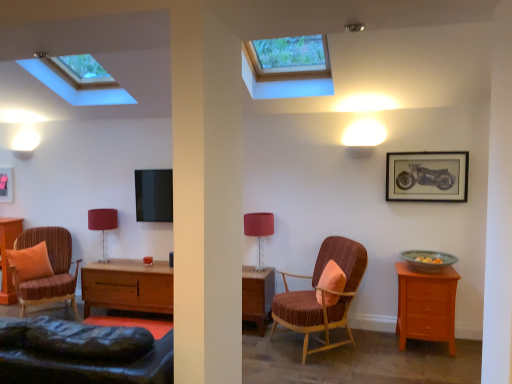
What is the approximate width of matte brown armchair at left, the 1th chair in the left-to-right sequence?

The width of matte brown armchair at left, the 1th chair in the left-to-right sequence, is 32.75 inches.

Describe the element at coordinates (315, 295) in the screenshot. This screenshot has width=512, height=384. I see `velvet-like brown armchair at center, which appears as the first chair when viewed from the right` at that location.

Measure the distance between velvet-like brown armchair at center, the second chair in the left-to-right sequence, and camera.

The depth of velvet-like brown armchair at center, the second chair in the left-to-right sequence, is 3.56 meters.

What do you see at coordinates (259, 230) in the screenshot?
I see `matte pink fabric at center, positioned as the first table lamp in front-to-back order` at bounding box center [259, 230].

The height and width of the screenshot is (384, 512). In order to click on matte black picture frame at upper left, acting as the second picture frame starting from the front in this screenshot , I will do `click(6, 185)`.

From a real-world perspective, is velvet-like brown armchair at center, which appears as the first chair when viewed from the right, below matte black picture frame at upper left, acting as the second picture frame starting from the front?

Yes.

Considering the sizes of objects velvet-like brown armchair at center, the second chair in the left-to-right sequence, and matte black picture frame at upper left, acting as the second picture frame starting from the front, in the image provided, who is bigger, velvet-like brown armchair at center, the second chair in the left-to-right sequence, or matte black picture frame at upper left, acting as the second picture frame starting from the front,?

With larger size is velvet-like brown armchair at center, the second chair in the left-to-right sequence.

Is velvet-like brown armchair at center, the second chair in the left-to-right sequence, to the left or to the right of matte black picture frame at upper left, which is counted as the second picture frame, starting from the right, in the image?

Clearly, velvet-like brown armchair at center, the second chair in the left-to-right sequence, is on the right of matte black picture frame at upper left, which is counted as the second picture frame, starting from the right, in the image.

Is velvet-like brown armchair at center, the second chair in the left-to-right sequence, in front of matte black picture frame at upper left, which appears as the first picture frame when viewed from the back?

Yes, velvet-like brown armchair at center, the second chair in the left-to-right sequence, is in front of matte black picture frame at upper left, which appears as the first picture frame when viewed from the back.

Could you measure the distance between matte black picture frame at upper right, positioned as the first picture frame in front-to-back order, and wooden nightstand at left?

matte black picture frame at upper right, positioned as the first picture frame in front-to-back order, and wooden nightstand at left are 4.25 meters apart from each other.

Who is shorter, matte black picture frame at upper right, which is the 1th picture frame from right to left, or wooden nightstand at left?

With less height is matte black picture frame at upper right, which is the 1th picture frame from right to left.

In terms of size, does matte black picture frame at upper right, positioned as the first picture frame in front-to-back order, appear bigger or smaller than wooden nightstand at left?

matte black picture frame at upper right, positioned as the first picture frame in front-to-back order, is smaller than wooden nightstand at left.

Is matte black picture frame at upper right, positioned as the first picture frame in front-to-back order, positioned beyond the bounds of wooden nightstand at left?

Yes, matte black picture frame at upper right, positioned as the first picture frame in front-to-back order, is located beyond the bounds of wooden nightstand at left.

In the image, is matte orange cushion at left, positioned as the 1th pillow in left-to-right order, positioned in front of or behind velvet-like brown armchair at center, the second chair in the left-to-right sequence?

Clearly, matte orange cushion at left, positioned as the 1th pillow in left-to-right order, is behind velvet-like brown armchair at center, the second chair in the left-to-right sequence.

Does matte orange cushion at left, which is counted as the 2th pillow, starting from the right, have a greater width compared to velvet-like brown armchair at center, which appears as the first chair when viewed from the right?

Incorrect, the width of matte orange cushion at left, which is counted as the 2th pillow, starting from the right, does not surpass that of velvet-like brown armchair at center, which appears as the first chair when viewed from the right.

Which object is wider, matte orange cushion at left, which is counted as the 2th pillow, starting from the right, or matte black picture frame at upper left, acting as the second picture frame starting from the front?

matte orange cushion at left, which is counted as the 2th pillow, starting from the right.

Can you confirm if matte orange cushion at left, which is counted as the 2th pillow, starting from the right, is bigger than matte black picture frame at upper left, the first picture frame from the left?

Yes, matte orange cushion at left, which is counted as the 2th pillow, starting from the right, is bigger than matte black picture frame at upper left, the first picture frame from the left.

Looking at this image, do you think matte orange cushion at left, which is counted as the 2th pillow, starting from the front, is within matte black picture frame at upper left, the first picture frame from the left, or outside of it?

matte orange cushion at left, which is counted as the 2th pillow, starting from the front, is not enclosed by matte black picture frame at upper left, the first picture frame from the left.

From the image's perspective, is matte orange cushion at left, which is counted as the 2th pillow, starting from the front, positioned above or below matte black picture frame at upper left, which is counted as the second picture frame, starting from the right?

From the image's perspective, matte orange cushion at left, which is counted as the 2th pillow, starting from the front, appears below matte black picture frame at upper left, which is counted as the second picture frame, starting from the right.

Is matte brown armchair at left, the 1th chair in the left-to-right sequence, not inside orange fabric pillow at center, marked as the 2th pillow in a back-to-front arrangement?

Yes, matte brown armchair at left, the 1th chair in the left-to-right sequence, is outside of orange fabric pillow at center, marked as the 2th pillow in a back-to-front arrangement.

Which of these two, matte brown armchair at left, which is counted as the second chair, starting from the right, or orange fabric pillow at center, which is the first pillow in front-to-back order, stands taller?

matte brown armchair at left, which is counted as the second chair, starting from the right.

Based on their positions, is matte brown armchair at left, which is counted as the second chair, starting from the right, located to the left or right of orange fabric pillow at center, marked as the 2th pillow in a back-to-front arrangement?

Clearly, matte brown armchair at left, which is counted as the second chair, starting from the right, is on the left of orange fabric pillow at center, marked as the 2th pillow in a back-to-front arrangement, in the image.

Is point (22, 292) less distant than point (338, 288)?

No, (22, 292) is behind (338, 288).

Is matte pink fabric at center, positioned as the first table lamp in front-to-back order, far away from matte black picture frame at upper right, which is the 1th picture frame from right to left?

matte pink fabric at center, positioned as the first table lamp in front-to-back order, is positioned a significant distance from matte black picture frame at upper right, which is the 1th picture frame from right to left.

From their relative heights in the image, would you say matte pink fabric at center, which appears as the 2th table lamp when viewed from the back, is taller or shorter than matte black picture frame at upper right, marked as the second picture frame in a left-to-right arrangement?

Considering their sizes, matte pink fabric at center, which appears as the 2th table lamp when viewed from the back, has more height than matte black picture frame at upper right, marked as the second picture frame in a left-to-right arrangement.

From the picture: How many degrees apart are the facing directions of matte pink fabric at center, which ranks as the first table lamp in right-to-left order, and matte black picture frame at upper right, marked as the second picture frame in a left-to-right arrangement?

There is a 2.56e-05-degree angle between the facing directions of matte pink fabric at center, which ranks as the first table lamp in right-to-left order, and matte black picture frame at upper right, marked as the second picture frame in a left-to-right arrangement.

Between matte pink fabric at center, which appears as the 2th table lamp when viewed from the back, and matte black picture frame at upper right, the second picture frame positioned from the back, which one has larger width?

matte pink fabric at center, which appears as the 2th table lamp when viewed from the back.

Considering the positions of objects light brown wooden chest of drawers at right and orange fabric pillow at center, which is the first pillow in front-to-back order, in the image provided, who is more to the right, light brown wooden chest of drawers at right or orange fabric pillow at center, which is the first pillow in front-to-back order,?

Positioned to the right is light brown wooden chest of drawers at right.

Which is in front, light brown wooden chest of drawers at right or orange fabric pillow at center, which ranks as the second pillow in left-to-right order?

light brown wooden chest of drawers at right is closer to the camera.

From the image's perspective, would you say light brown wooden chest of drawers at right is shown under orange fabric pillow at center, which is the first pillow in front-to-back order?

Yes.

Can you see light brown wooden chest of drawers at right touching orange fabric pillow at center, marked as the 1th pillow in a right-to-left arrangement?

light brown wooden chest of drawers at right is not next to orange fabric pillow at center, marked as the 1th pillow in a right-to-left arrangement, and they're not touching.

From the image's perspective, starting from the matte black picture frame at upper left, acting as the second picture frame starting from the front, which chair is the 2nd one below? Please provide its 2D coordinates.

[(315, 295)]

Find the location of a particular element. nightstand below the matte black picture frame at upper right, the second picture frame positioned from the back (from a real-world perspective) is located at coordinates (6, 257).

When comparing their distances from matte pink fabric at center, which ranks as the first table lamp in right-to-left order, does orange fabric pillow at center, marked as the 2th pillow in a back-to-front arrangement, or matte red lampshade at center, positioned as the 1th table lamp in left-to-right order, seem further?

matte red lampshade at center, positioned as the 1th table lamp in left-to-right order, is positioned further to the anchor matte pink fabric at center, which ranks as the first table lamp in right-to-left order.

From the image, which object appears to be farther from matte red lampshade at center, which is the second table lamp from right to left, wooden nightstand at left or matte pink fabric at center, positioned as the first table lamp in front-to-back order?

matte pink fabric at center, positioned as the first table lamp in front-to-back order, is positioned further to the anchor matte red lampshade at center, which is the second table lamp from right to left.

Estimate the real-world distances between objects in this image. Which object is closer to matte black picture frame at upper left, which appears as the first picture frame when viewed from the back, matte pink fabric at center, the second table lamp positioned from the left, or matte red lampshade at center, positioned as the 1th table lamp in left-to-right order?

matte red lampshade at center, positioned as the 1th table lamp in left-to-right order, lies closer to matte black picture frame at upper left, which appears as the first picture frame when viewed from the back, than the other object.

Looking at the image, which one is located further to wooden nightstand at left, matte pink fabric at center, which ranks as the first table lamp in right-to-left order, or matte red lampshade at center, positioned as the 1th table lamp in left-to-right order?

Based on the image, matte pink fabric at center, which ranks as the first table lamp in right-to-left order, appears to be further to wooden nightstand at left.

Which object lies nearer to the anchor point matte black picture frame at upper left, which is counted as the second picture frame, starting from the right, light brown wooden chest of drawers at right or matte pink fabric at center, which appears as the 2th table lamp when viewed from the back?

matte pink fabric at center, which appears as the 2th table lamp when viewed from the back.

From the picture: Based on their spatial positions, is velvet-like brown armchair at center, which appears as the first chair when viewed from the right, or wooden nightstand at left closer to orange fabric pillow at center, which is the first pillow in front-to-back order?

Based on the image, velvet-like brown armchair at center, which appears as the first chair when viewed from the right, appears to be nearer to orange fabric pillow at center, which is the first pillow in front-to-back order.

Based on their spatial positions, is matte orange cushion at left, positioned as the 1th pillow in left-to-right order, or matte black picture frame at upper left, acting as the second picture frame starting from the front, closer to matte red lampshade at center, which is the first table lamp in back-to-front order?

matte orange cushion at left, positioned as the 1th pillow in left-to-right order, lies closer to matte red lampshade at center, which is the first table lamp in back-to-front order, than the other object.

Looking at the image, which one is located further to matte orange cushion at left, which is counted as the 2th pillow, starting from the front, matte pink fabric at center, positioned as the first table lamp in front-to-back order, or matte black picture frame at upper right, the second picture frame positioned from the back?

Based on the image, matte black picture frame at upper right, the second picture frame positioned from the back, appears to be further to matte orange cushion at left, which is counted as the 2th pillow, starting from the front.

Image resolution: width=512 pixels, height=384 pixels. In order to click on chair between matte black picture frame at upper left, which appears as the first picture frame when viewed from the back, and matte pink fabric at center, which ranks as the first table lamp in right-to-left order in this screenshot , I will do `click(51, 267)`.

Find the location of a particular element. The height and width of the screenshot is (384, 512). pillow located between matte black picture frame at upper left, which is counted as the second picture frame, starting from the right, and matte pink fabric at center, which ranks as the first table lamp in right-to-left order, in the left-right direction is located at coordinates pos(30,262).

You are a GUI agent. You are given a task and a screenshot of the screen. Output one action in this format:
    pyautogui.click(x=<x>, y=<y>)
    Task: Click on the chest of drawers located between matte brown armchair at left, which is counted as the second chair, starting from the right, and matte black picture frame at upper right, the second picture frame positioned from the back, in the left-right direction
    The width and height of the screenshot is (512, 384).
    Given the screenshot: What is the action you would take?
    pyautogui.click(x=426, y=305)

Locate an element on the screen. Image resolution: width=512 pixels, height=384 pixels. chair between matte brown armchair at left, the 1th chair in the left-to-right sequence, and orange fabric pillow at center, marked as the 1th pillow in a right-to-left arrangement, from left to right is located at coordinates (315, 295).